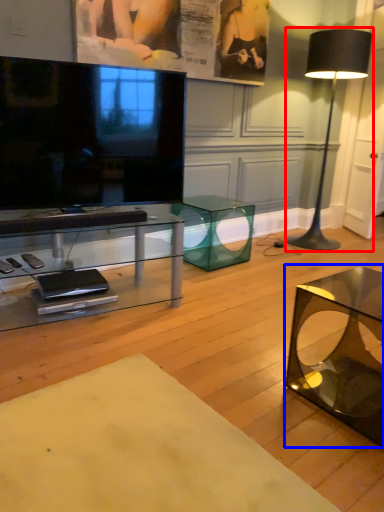
Question: Which of the following is the farthest to the observer, lamp (highlighted by a red box) or coffee table (highlighted by a blue box)?

Choices:
 (A) lamp
 (B) coffee table

Answer: (A)